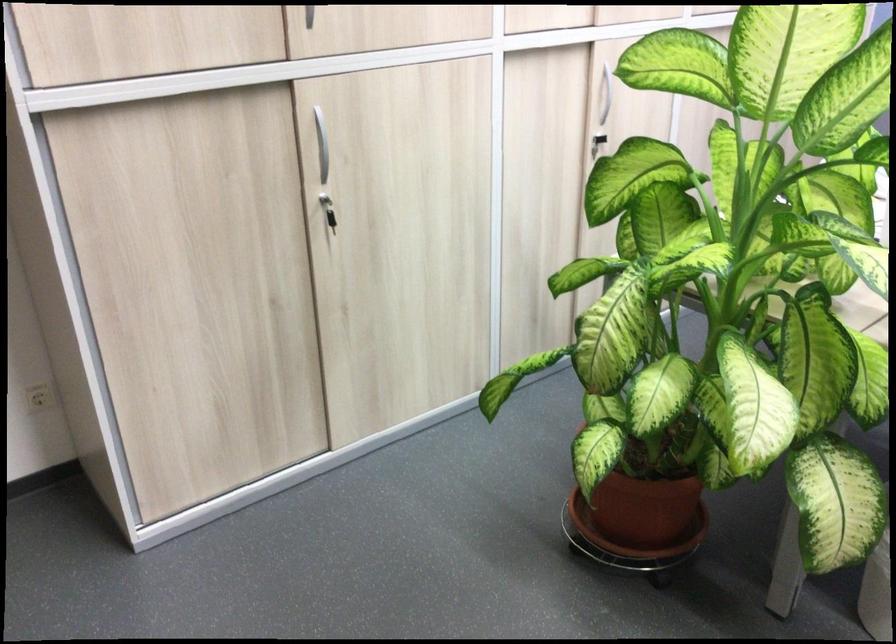
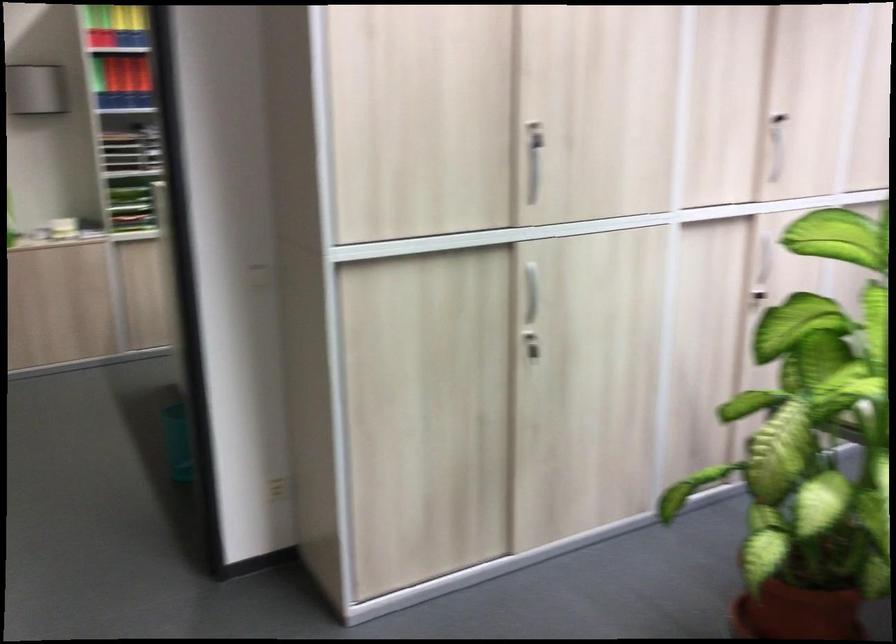
Locate, in the second image, the point that corresponds to [631,502] in the first image.

(797, 612)